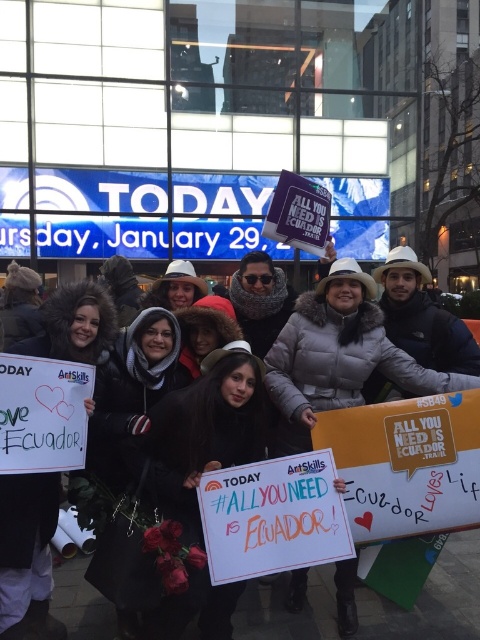
Who is more distant from viewer, (367, 604) or (235, 529)?

Point (367, 604)

Is point (95, 637) behind point (242, 554)?

Yes.

Does point (437, 605) come farther from viewer compared to point (337, 525)?

That is True.

Where is `white fur coat at center`? Image resolution: width=480 pixels, height=640 pixels. white fur coat at center is located at coordinates (431, 600).